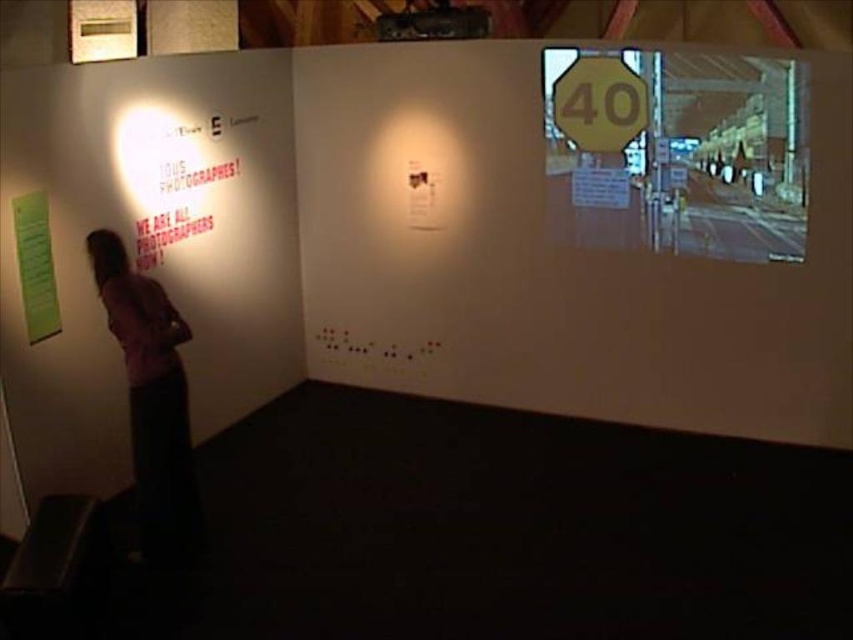
Looking at this image, you are an artist planning to hang two new pieces in the exhibition space. You have a yellow matte sign at upper right and a green paper at left. Based on their sizes, which object should you place higher on the wall to ensure both are visible without overlapping?

The yellow matte sign at upper right has a lesser height compared to the green paper at left. To ensure visibility without overlapping, place the taller green paper at left lower and the shorter yellow matte sign at upper right higher on the wall.

You are an artist planning to install a new artwork in the exhibition space. You have a rectangular canvas that is 1.2 meters wide. You want to place it between the yellow reflective sign at upper right and the green paper at left without overlapping either. Is there enough space? Please consider the widths of both objects when determining the placement.

The yellow reflective sign at upper right is wider than the green paper at left. Since the canvas is 1.2 meters wide, you need to ensure the space between them is at least 1.2 meters. However, without knowing the exact distance between the two objects, it is impossible to confirm if the canvas will fit. The widths of the objects themselves do not directly determine the available space between them.